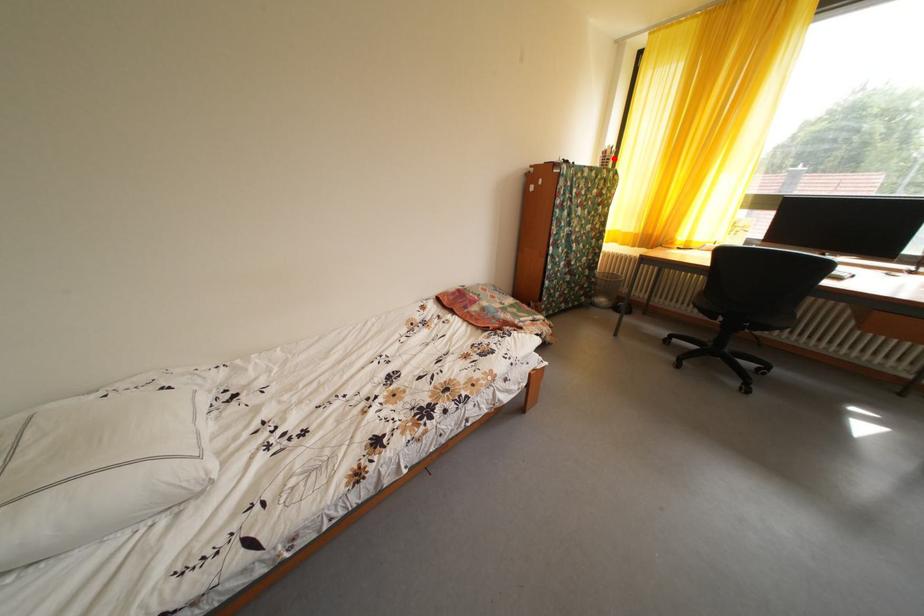
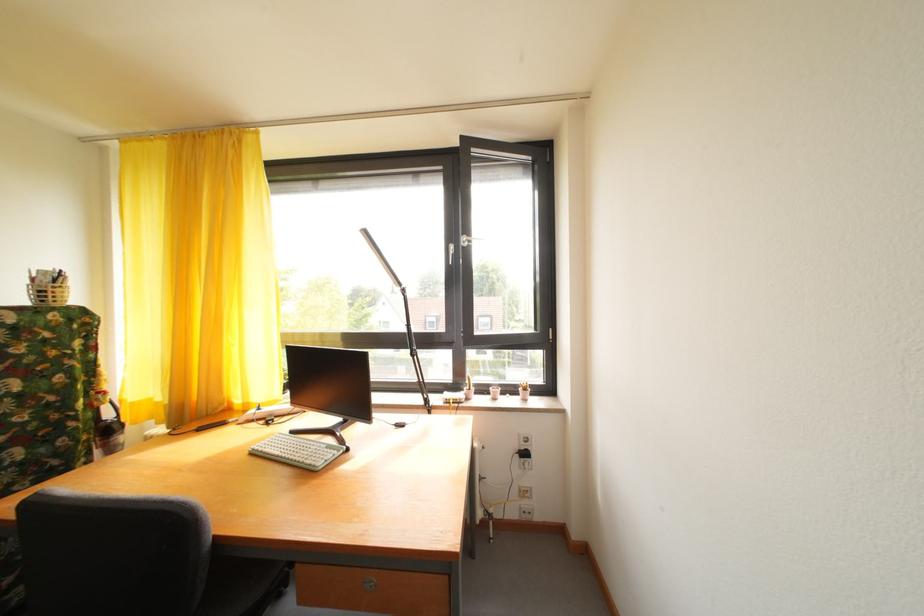
Where in the second image is the point corresponding to the highlighted location from the first image?

(43, 286)